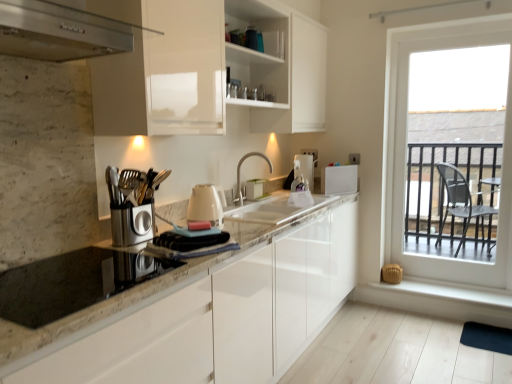
Find the location of a particular element. blank space situated above white smooth window sill at lower right (from a real-world perspective) is located at coordinates (430, 286).